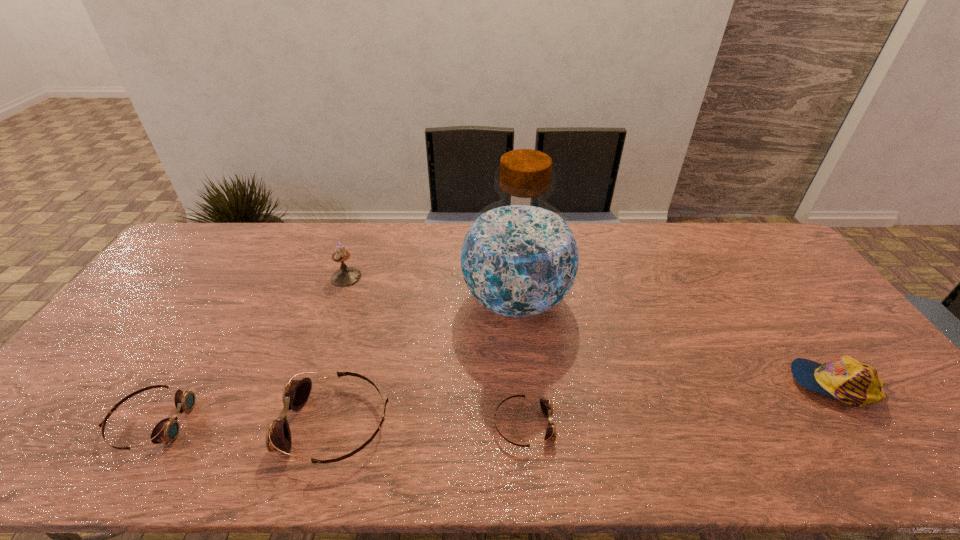
Where is `object that is at the near right corner`? This screenshot has height=540, width=960. object that is at the near right corner is located at coordinates (853, 382).

You are a GUI agent. You are given a task and a screenshot of the screen. Output one action in this format:
    pyautogui.click(x=<x>, y=<y>)
    Task: Click on the vacant region at the far edge of the desktop
    
    Given the screenshot: What is the action you would take?
    (692, 249)

Identify the location of free space at the near edge of the desktop. (639, 406).

Where is `vacant position at the right edge of the desktop`? This screenshot has width=960, height=540. vacant position at the right edge of the desktop is located at coordinates (766, 266).

In the image, there is a desktop. Identify the location of vacant space at the far left corner. (208, 263).

Find the location of a particular element. vacant space at the near right corner of the desktop is located at coordinates (898, 421).

You are a GUI agent. You are given a task and a screenshot of the screen. Output one action in this format:
    pyautogui.click(x=<x>, y=<y>)
    Task: Click on the blank region between the water jug and the leftmost object
    This screenshot has width=960, height=540.
    Given the screenshot: What is the action you would take?
    pyautogui.click(x=333, y=361)

You are a GUI agent. You are given a task and a screenshot of the screen. Output one action in this format:
    pyautogui.click(x=<x>, y=<y>)
    Task: Click on the vacant space that's between the second goggles from left to right and the fifth tallest object
    This screenshot has height=540, width=960.
    Given the screenshot: What is the action you would take?
    pyautogui.click(x=243, y=423)

At what (x,y) coordinates should I click in order to perform the action: click on free spot between the leftmost object and the tallest goggles. Please return your answer as a coordinate pair (x, y). The image size is (960, 540). Looking at the image, I should click on (243, 423).

Locate an element on the screen. This screenshot has width=960, height=540. vacant space that's between the shortest goggles and the second tallest object is located at coordinates (435, 351).